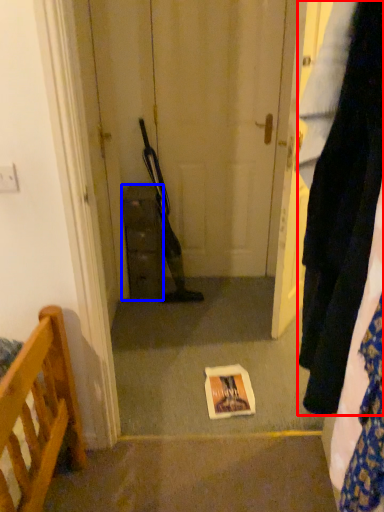
Question: Among these objects, which one is nearest to the camera, clothing (highlighted by a red box) or cabinetry (highlighted by a blue box)?

Choices:
 (A) clothing
 (B) cabinetry

Answer: (A)